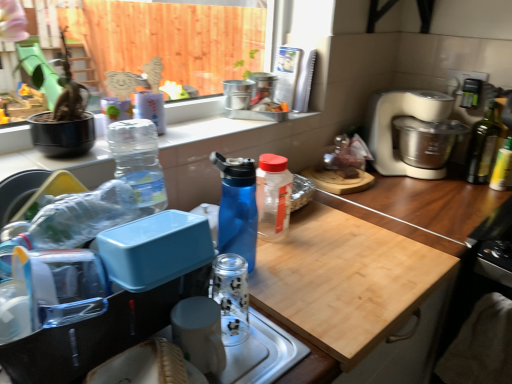
What do you see at coordinates (391, 127) in the screenshot? The width and height of the screenshot is (512, 384). I see `beige plastic food processor at right` at bounding box center [391, 127].

From the picture: In order to face wooden cutting board at center, should I rotate leftwards or rightwards?

To align with it, rotate right about 6.156°.

In order to face wooden cutting board at center, should I rotate leftwards or rightwards?

To face it directly, rotate right by 1.999 degrees.

Describe the element at coordinates (423, 207) in the screenshot. I see `wooden cutting board at center` at that location.

Locate an element on the screen. transparent glass jar at sink, acting as the second appliance starting from the top is located at coordinates (199, 333).

Where is `transparent plastic bottle at center, which is the 3th bottle in back-to-front order`? transparent plastic bottle at center, which is the 3th bottle in back-to-front order is located at coordinates (273, 196).

Where is `blue glossy water bottle at center, acting as the 4th bottle starting from the back`? blue glossy water bottle at center, acting as the 4th bottle starting from the back is located at coordinates (237, 207).

Considering the points (478, 187) and (237, 166), which point is behind, point (478, 187) or point (237, 166)?

The point (478, 187) is farther.

Is wooden cutting board at center surrounding blue glossy water bottle at center, the 2th bottle viewed from the front?

No.

Who is bigger, wooden cutting board at center or blue glossy water bottle at center, acting as the 4th bottle starting from the back?

Bigger between the two is wooden cutting board at center.

This screenshot has height=384, width=512. What are the coordinates of `bottle that is the 1st one when counting backward from the wooden cutting board at center` in the screenshot? It's located at [x=237, y=207].

Image resolution: width=512 pixels, height=384 pixels. What are the coordinates of `the 2nd bottle positioned below the wooden cutting board at center (from a real-world perspective)` in the screenshot? It's located at (483, 146).

From a real-world perspective, is wooden cutting board at center below dark green glass bottle at right, which is the 5th bottle from front to back?

No.

Is wooden cutting board at center to the left or to the right of dark green glass bottle at right, the 1th bottle viewed from the back, in the image?

wooden cutting board at center is to the left of dark green glass bottle at right, the 1th bottle viewed from the back.

What's the angular difference between wooden cutting board at center and dark green glass bottle at right, which is the 5th bottle from front to back,'s facing directions?

There is a 80.5-degree angle between the facing directions of wooden cutting board at center and dark green glass bottle at right, which is the 5th bottle from front to back.

Is transparent glass bottle at lower center, the fifth bottle viewed from the back, bigger than transparent plastic bottle at center, which is counted as the third bottle, starting from the left?

Actually, transparent glass bottle at lower center, the fifth bottle viewed from the back, might be smaller than transparent plastic bottle at center, which is counted as the third bottle, starting from the left.

In terms of height, does transparent glass bottle at lower center, the 2th bottle viewed from the left, look taller or shorter compared to transparent plastic bottle at center, which is counted as the third bottle, starting from the left?

transparent glass bottle at lower center, the 2th bottle viewed from the left, is shorter than transparent plastic bottle at center, which is counted as the third bottle, starting from the left.

Considering the relative sizes of transparent glass bottle at lower center, the 2th bottle viewed from the left, and transparent plastic bottle at center, which is the 3th bottle in back-to-front order, in the image provided, is transparent glass bottle at lower center, the 2th bottle viewed from the left, thinner than transparent plastic bottle at center, which is the 3th bottle in back-to-front order,?

Correct, the width of transparent glass bottle at lower center, the 2th bottle viewed from the left, is less than that of transparent plastic bottle at center, which is the 3th bottle in back-to-front order.

Considering the relative positions of wooden cutting board at center and transparent glass bottle at lower center, which is counted as the fourth bottle, starting from the right, in the image provided, is wooden cutting board at center in front of transparent glass bottle at lower center, which is counted as the fourth bottle, starting from the right,?

No, wooden cutting board at center is further to the viewer.

How distant is wooden cutting board at center from transparent glass bottle at lower center, the first bottle positioned from the front?

wooden cutting board at center is 10.81 inches away from transparent glass bottle at lower center, the first bottle positioned from the front.

Can you see wooden cutting board at center touching transparent glass bottle at lower center, the 2th bottle viewed from the left?

No.

Does wooden cutting board at center have a lesser height compared to transparent glass bottle at lower center, the first bottle positioned from the front?

Yes, wooden cutting board at center is shorter than transparent glass bottle at lower center, the first bottle positioned from the front.

Could you tell me if metallic silver canisters at upper center, marked as the second appliance in a left-to-right arrangement, is facing blue glossy water bottle at center, the first bottle positioned from the left?

No, metallic silver canisters at upper center, marked as the second appliance in a left-to-right arrangement, is not facing towards blue glossy water bottle at center, the first bottle positioned from the left.

Is metallic silver canisters at upper center, which is the first appliance in top-to-bottom order, shorter than blue glossy water bottle at center, the 5th bottle viewed from the right?

Yes, metallic silver canisters at upper center, which is the first appliance in top-to-bottom order, is shorter than blue glossy water bottle at center, the 5th bottle viewed from the right.

Is metallic silver canisters at upper center, which appears as the second appliance when ordered from the bottom, to the left of blue glossy water bottle at center, acting as the 4th bottle starting from the back, from the viewer's perspective?

No, metallic silver canisters at upper center, which appears as the second appliance when ordered from the bottom, is not to the left of blue glossy water bottle at center, acting as the 4th bottle starting from the back.

From a real-world perspective, is metallic silver canisters at upper center, the first appliance from the right, beneath blue glossy water bottle at center, the 5th bottle viewed from the right?

Actually, metallic silver canisters at upper center, the first appliance from the right, is physically above blue glossy water bottle at center, the 5th bottle viewed from the right, in the real world.

Considering the relative sizes of transparent plastic bottle at center, which is counted as the third bottle, starting from the left, and green glass bottle at right, which appears as the second bottle when viewed from the back, in the image provided, is transparent plastic bottle at center, which is counted as the third bottle, starting from the left, bigger than green glass bottle at right, which appears as the second bottle when viewed from the back,?

Correct, transparent plastic bottle at center, which is counted as the third bottle, starting from the left, is larger in size than green glass bottle at right, which appears as the second bottle when viewed from the back.

Considering the positions of points (275, 221) and (495, 182), is point (275, 221) farther from camera compared to point (495, 182)?

No.

Considering the sizes of objects transparent plastic bottle at center, which is the 3th bottle in back-to-front order, and green glass bottle at right, which is the 1th bottle in right-to-left order, in the image provided, who is taller, transparent plastic bottle at center, which is the 3th bottle in back-to-front order, or green glass bottle at right, which is the 1th bottle in right-to-left order,?

transparent plastic bottle at center, which is the 3th bottle in back-to-front order.

Is the depth of transparent glass bottle at lower center, which is counted as the fourth bottle, starting from the right, greater than that of transparent glass jar at sink, acting as the second appliance starting from the top?

Yes.

Are transparent glass bottle at lower center, the first bottle positioned from the front, and transparent glass jar at sink, acting as the second appliance starting from the top, far apart?

No, there isn't a large distance between transparent glass bottle at lower center, the first bottle positioned from the front, and transparent glass jar at sink, acting as the second appliance starting from the top.

Considering the sizes of objects transparent glass bottle at lower center, the fifth bottle viewed from the back, and transparent glass jar at sink, which appears as the second appliance when viewed from the back, in the image provided, who is bigger, transparent glass bottle at lower center, the fifth bottle viewed from the back, or transparent glass jar at sink, which appears as the second appliance when viewed from the back,?

Bigger between the two is transparent glass jar at sink, which appears as the second appliance when viewed from the back.

Is transparent glass bottle at lower center, the 2th bottle viewed from the left, to the left or to the right of transparent glass jar at sink, which appears as the second appliance when viewed from the back, in the image?

Clearly, transparent glass bottle at lower center, the 2th bottle viewed from the left, is on the right of transparent glass jar at sink, which appears as the second appliance when viewed from the back, in the image.

Image resolution: width=512 pixels, height=384 pixels. I want to click on countertop on the right of blue glossy water bottle at center, the first bottle positioned from the left, so click(x=423, y=207).

From a real-world perspective, count 2nd bottles downward from the wooden cutting board at center and point to it. Please provide its 2D coordinates.

[(483, 146)]

Looking at the image, which one is located closer to metallic silver canisters at upper center, which is the first appliance in top-to-bottom order, dark green glass bottle at right, which is counted as the 2th bottle, starting from the right, or green glass bottle at right, the 4th bottle viewed from the front?

dark green glass bottle at right, which is counted as the 2th bottle, starting from the right, is closer to metallic silver canisters at upper center, which is the first appliance in top-to-bottom order.

Estimate the real-world distances between objects in this image. Which object is closer to transparent glass jar at sink, acting as the second appliance starting from the top, translucent plastic bag at upper right or transparent glass bottle at lower center, the fifth bottle viewed from the back?

Based on the image, transparent glass bottle at lower center, the fifth bottle viewed from the back, appears to be nearer to transparent glass jar at sink, acting as the second appliance starting from the top.

In the scene shown: Looking at the image, which one is located further to transparent glass jar at sink, which ranks as the second appliance in right-to-left order, wooden cutting board at center or beige plastic food processor at right?

Among the two, beige plastic food processor at right is located further to transparent glass jar at sink, which ranks as the second appliance in right-to-left order.

When comparing their distances from transparent glass bottle at lower center, the fifth bottle viewed from the back, does blue glossy water bottle at center, the 5th bottle viewed from the right, or metallic silver canisters at upper center, which is the first appliance in top-to-bottom order, seem closer?

blue glossy water bottle at center, the 5th bottle viewed from the right, lies closer to transparent glass bottle at lower center, the fifth bottle viewed from the back, than the other object.

Considering their positions, is translucent plastic bag at upper right positioned further to beige plastic food processor at right than blue glossy water bottle at center, acting as the 4th bottle starting from the back?

blue glossy water bottle at center, acting as the 4th bottle starting from the back.

Based on their spatial positions, is transparent glass bottle at lower center, which is counted as the fourth bottle, starting from the right, or transparent plastic bottle at center, the third bottle positioned from the right, closer to translucent plastic bag at upper right?

transparent plastic bottle at center, the third bottle positioned from the right, is closer to translucent plastic bag at upper right.

Based on their spatial positions, is wooden cutting board at center or translucent plastic bag at upper right further from wooden cutting board at center?

The object further to wooden cutting board at center is translucent plastic bag at upper right.

Based on their spatial positions, is metallic silver canisters at upper center, the 2th appliance when ordered from front to back, or blue glossy water bottle at center, the 2th bottle viewed from the front, further from wooden cutting board at center?

The object further to wooden cutting board at center is metallic silver canisters at upper center, the 2th appliance when ordered from front to back.

Locate an element on the screen. The image size is (512, 384). cutting board situated between blue glossy water bottle at center, acting as the 4th bottle starting from the back, and dark green glass bottle at right, which is counted as the 2th bottle, starting from the right, from left to right is located at coordinates (345, 280).

Locate an element on the screen. Image resolution: width=512 pixels, height=384 pixels. home appliance located between transparent plastic bottle at center, which is the 3th bottle in back-to-front order, and green glass bottle at right, the fifth bottle when ordered from left to right, in the left-right direction is located at coordinates (391, 127).

This screenshot has height=384, width=512. What are the coordinates of `food situated between transparent plastic bottle at center, which is the 3th bottle in back-to-front order, and dark green glass bottle at right, which is counted as the 2th bottle, starting from the right, from left to right` in the screenshot? It's located at (344, 158).

At what (x,y) coordinates should I click in order to perform the action: click on appliance between transparent glass jar at sink, which is the 1th appliance in bottom-to-top order, and green glass bottle at right, the fifth bottle when ordered from left to right, from left to right. Please return your answer as a coordinate pair (x, y). The height and width of the screenshot is (384, 512). Looking at the image, I should click on (262, 86).